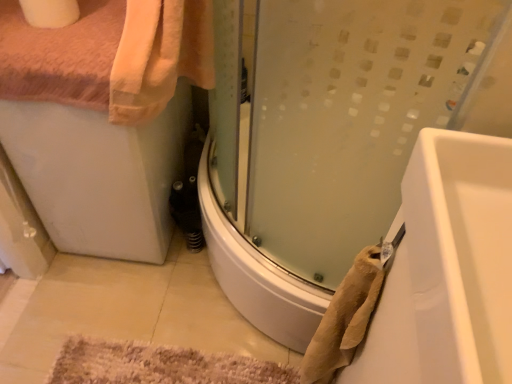
At what (x,y) coordinates should I click in order to perform the action: click on free space in front of white matte toilet paper at upper left. Please return your answer as a coordinate pair (x, y). The width and height of the screenshot is (512, 384). Looking at the image, I should click on (51, 32).